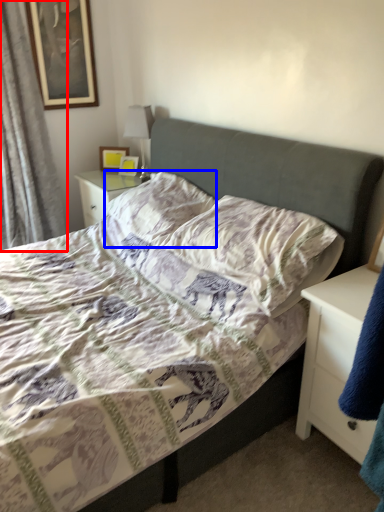
Question: Which point is further to the camera, curtain (highlighted by a red box) or pillow (highlighted by a blue box)?

Choices:
 (A) curtain
 (B) pillow

Answer: (A)